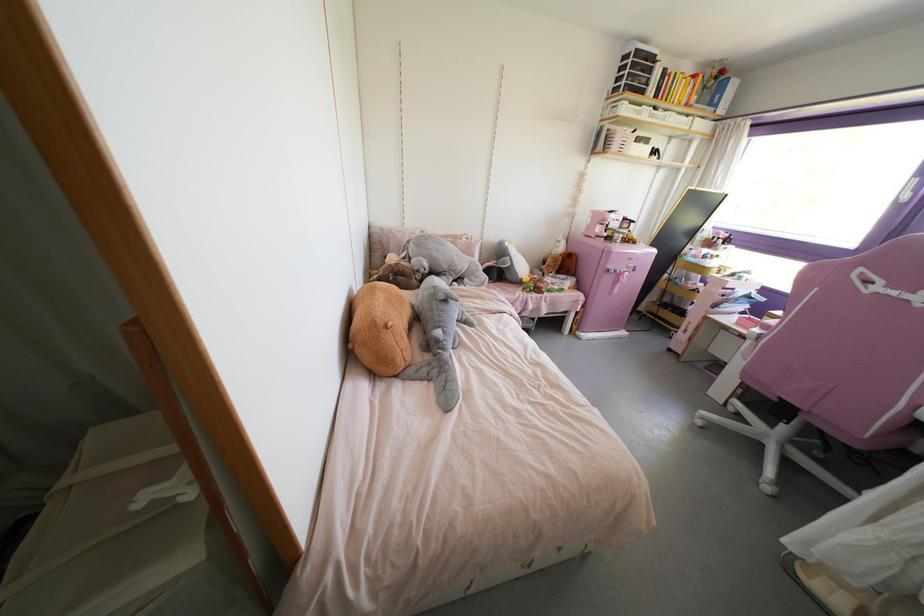
You are a GUI agent. You are given a task and a screenshot of the screen. Output one action in this format:
    pyautogui.click(x=<x>, y=<y>)
    Task: Click on the penguin plush toy
    This screenshot has width=924, height=616.
    Given the screenshot: What is the action you would take?
    pyautogui.click(x=511, y=262)